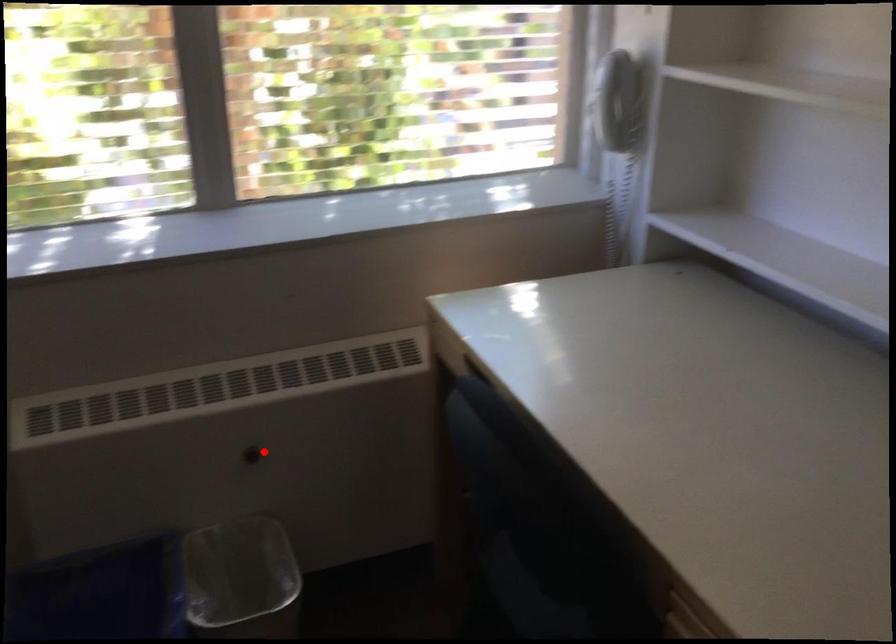
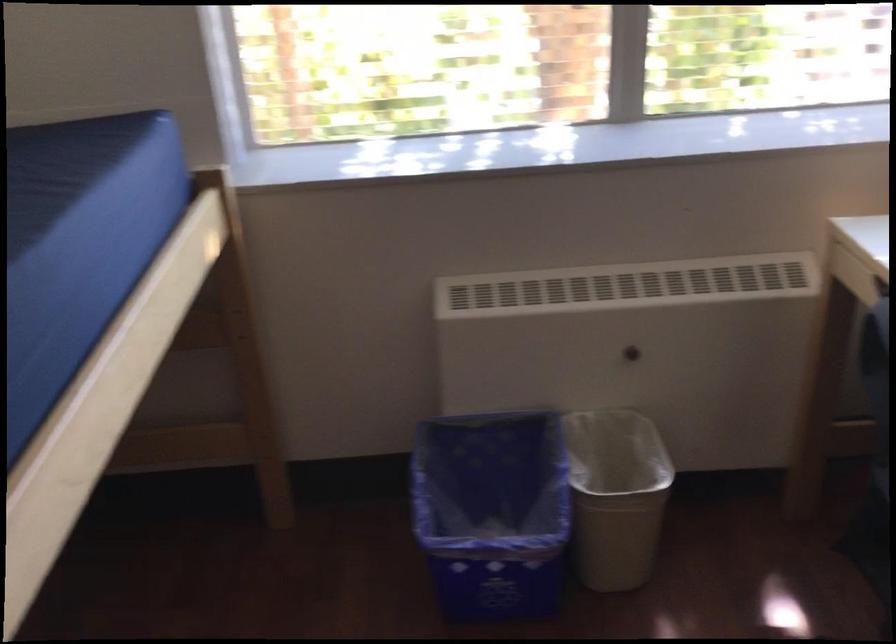
Locate, in the second image, the point that corresponds to the highlighted location in the first image.

(634, 351)